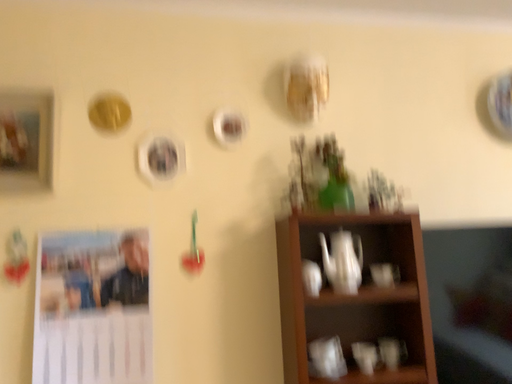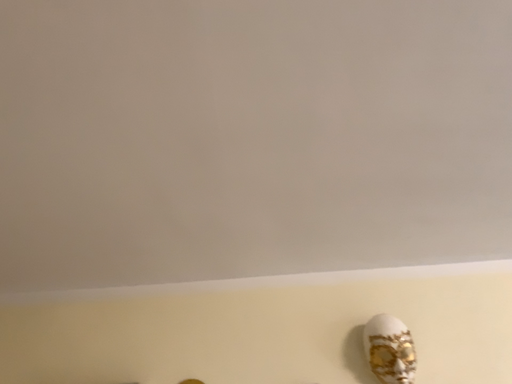
Question: How did the camera likely rotate when shooting the video?

Choices:
 (A) rotated downward
 (B) rotated upward

Answer: (B)